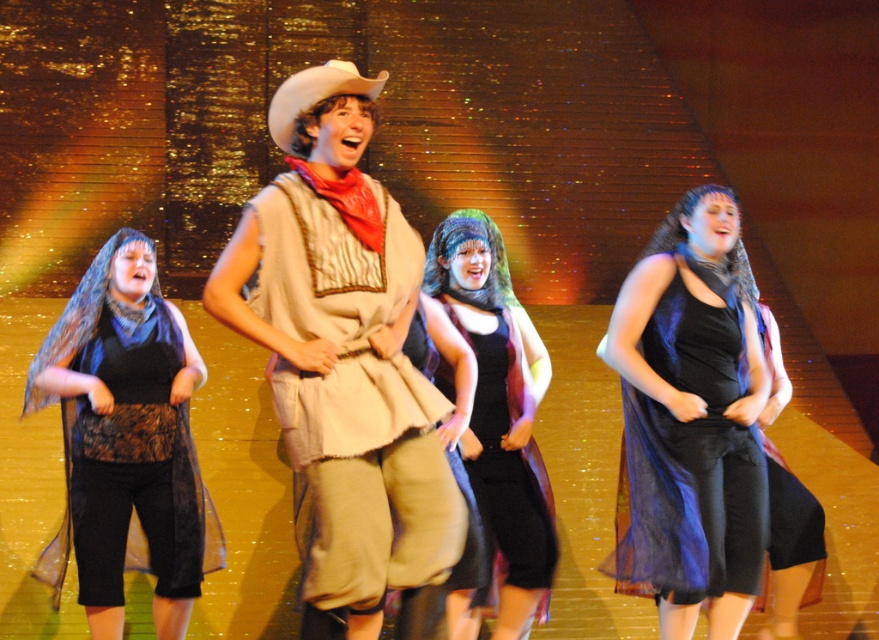
Question: Can you confirm if black sheer dress at center is positioned to the left of black velvet dress at center?

Choices:
 (A) no
 (B) yes

Answer: (A)

Question: Considering the real-world distances, which object is farthest from the black sheer scarf at left?

Choices:
 (A) black velvet dress at center
 (B) rustic burlap vest at center
 (C) black sheer dress at center

Answer: (C)

Question: Which object appears farthest from the camera in this image?

Choices:
 (A) black sheer scarf at left
 (B) black velvet dress at center
 (C) black sheer dress at center

Answer: (A)

Question: In this image, where is rustic burlap vest at center located relative to black velvet dress at center?

Choices:
 (A) above
 (B) below

Answer: (A)

Question: Is rustic burlap vest at center wider than black sheer scarf at left?

Choices:
 (A) no
 (B) yes

Answer: (A)

Question: Which point is closer to the camera?

Choices:
 (A) (545, 518)
 (B) (723, 308)
 (C) (151, 252)
 (D) (324, 312)

Answer: (D)